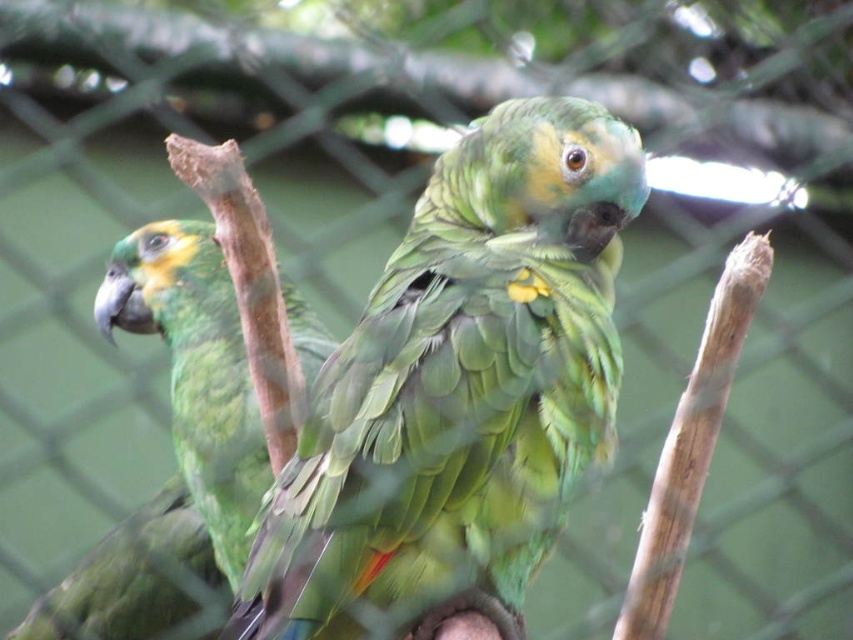
You are a photographer aiming to capture a closeup shot of the green matte parrot at center. The camera you are using has a focus point at coordinate 0.608, 0.539. Will this focus point align with the parrot?

Yes, the focus point at (x=459, y=388) aligns perfectly with the green matte parrot at center since that is exactly where the parrot is positioned.

You are standing in front of the parrots and want to reach a point that is exactly 1.5 meters away from you. Is the point at coordinates point (437, 512) within this distance?

The distance of point (437, 512) from viewer is 1.58 meters, so it is slightly beyond the 1.5 meters range. You would need to move closer by 0.08 meters to reach the desired distance.